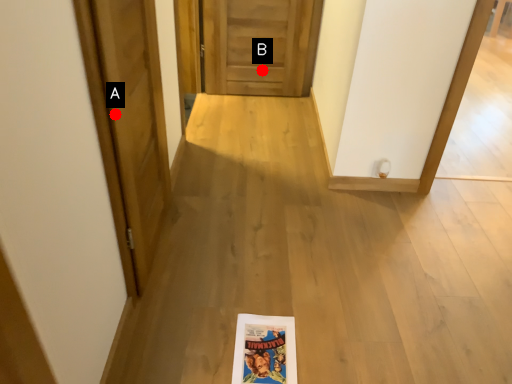
Question: Two points are circled on the image, labeled by A and B beside each circle. Which point appears closest to the camera in this image?

Choices:
 (A) A is closer
 (B) B is closer

Answer: (A)